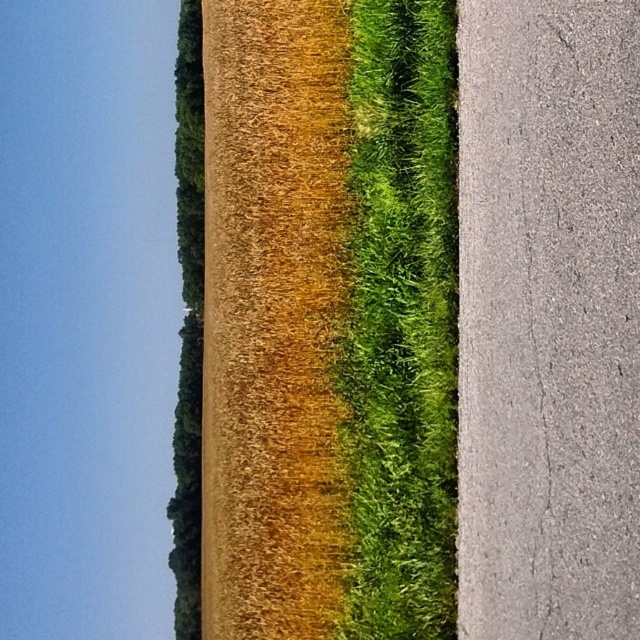
Which is below, green fuzzy grass at center or green leafy tree at upper center?

Positioned lower is green fuzzy grass at center.

Which is in front, point (397, 397) or point (195, 355)?

Point (397, 397) is in front.

The height and width of the screenshot is (640, 640). I want to click on green fuzzy grass at center, so click(x=401, y=321).

Between point (268, 419) and point (356, 362), which one is positioned in front?

Positioned in front is point (356, 362).

Is golden textured wheat at center taller than green fuzzy grass at center?

Yes.

Who is more distant from viewer, (304, 68) or (419, 602)?

The point (304, 68) is more distant.

At what (x,y) coordinates should I click in order to perform the action: click on golden textured wheat at center. Please return your answer as a coordinate pair (x, y). The height and width of the screenshot is (640, 640). Looking at the image, I should click on (273, 316).

Is point (204, 76) closer to viewer compared to point (189, 483)?

Yes, it is in front of point (189, 483).

Describe the element at coordinates (273, 316) in the screenshot. This screenshot has width=640, height=640. I see `golden textured wheat at center` at that location.

Identify the location of golden textured wheat at center. The image size is (640, 640). (273, 316).